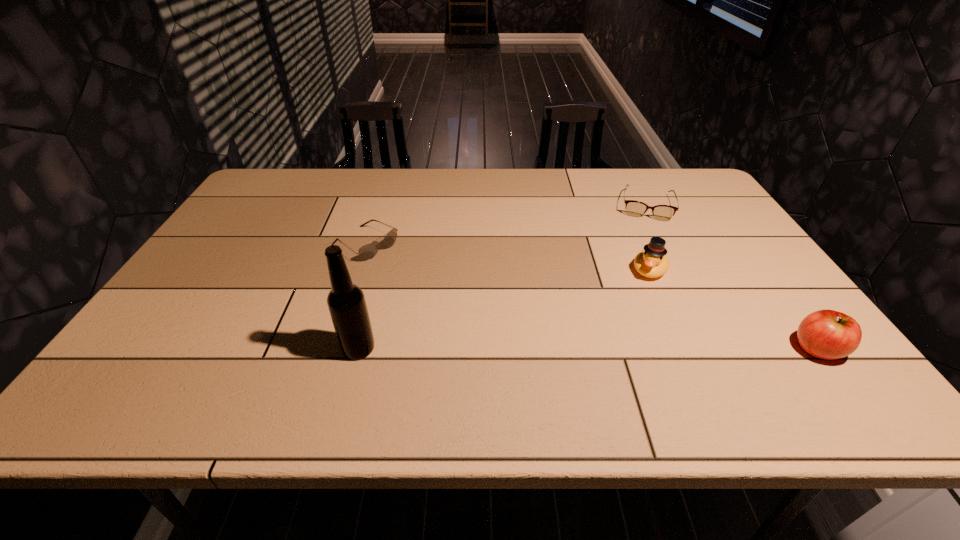
Find the location of `vacant spot on the desktop that is between the beer bottle and the apple and is positioned on the front-facing side of the sunglasses`. vacant spot on the desktop that is between the beer bottle and the apple and is positioned on the front-facing side of the sunglasses is located at coordinates (540, 349).

This screenshot has height=540, width=960. In order to click on vacant space on the desktop that is between the beer bottle and the rightmost object and is positioned on the face of the farthest object in this screenshot , I will do `click(643, 349)`.

Where is `free spot on the desktop that is between the beer bottle and the rightmost object and is positioned on the front-facing side of the duck`? This screenshot has width=960, height=540. free spot on the desktop that is between the beer bottle and the rightmost object and is positioned on the front-facing side of the duck is located at coordinates (614, 349).